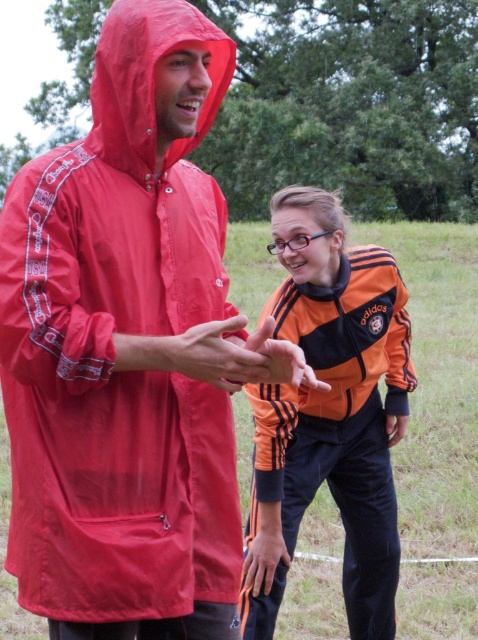
Looking at this image, you are taking a photo of two people in a park. The first person is at point (269, 611) and the second is at point (275, 564). Which person will appear closer to the camera in your photo?

Point (269, 611) is further to the camera than point (275, 564), so the first person at point (269, 611) will appear closer to the camera in the photo.

You are standing in a park and see two people. One is wearing a bright red rain poncho with white text and logos on the sleeves, and the other is in an orange and black Adidas tracksuit. There is a point at coordinates point [304,362]. Can you estimate how far this point is from you in feet?

The point [304,362] is 7.33 feet away from the viewer.